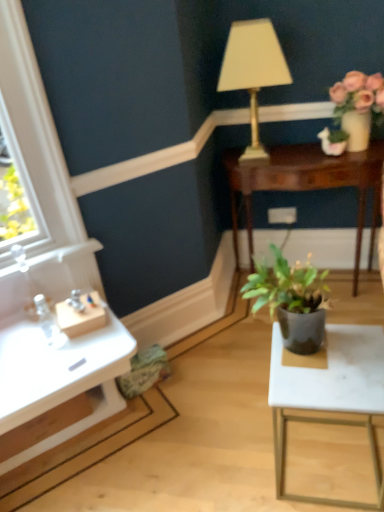
Locate an element on the screen. This screenshot has width=384, height=512. free spot in front of green fabric swivel chair at lower center is located at coordinates (144, 416).